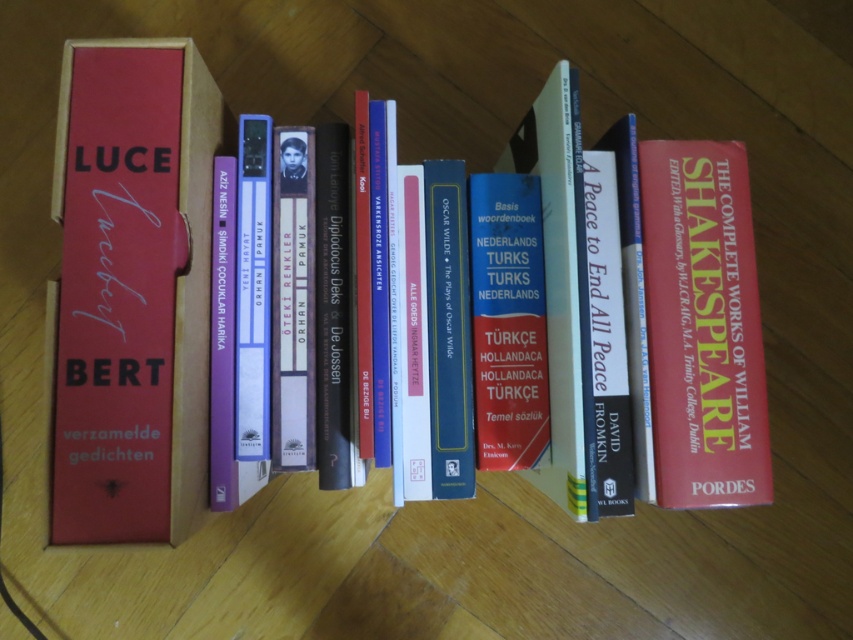
What is the position of the hardcover book at center?

The hardcover book at center is positioned at point (292, 300).

You are organizing a library shelf and need to place the matte red book at left and the matte purple binder at center. According to the image, which object is placed on top of the other?

The matte red book at left is positioned over matte purple binder at center, meaning it is placed on top of the binder.

What is the 2D coordinate of the matte red book at left in the image?

The matte red book at left is located at the 2D coordinate point of (x=115, y=292).